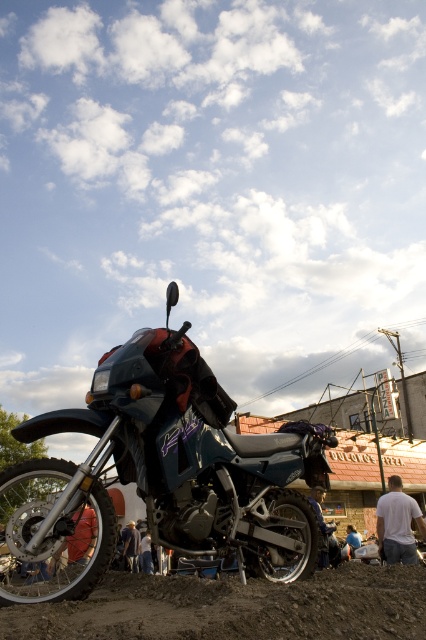
From the picture: Can you confirm if metallic blue motorcycle at center is smaller than brown dirt track at lower center?

Incorrect, metallic blue motorcycle at center is not smaller in size than brown dirt track at lower center.

Who is lower down, metallic blue motorcycle at center or brown dirt track at lower center?

metallic blue motorcycle at center

Find the location of a particular element. The width and height of the screenshot is (426, 640). metallic blue motorcycle at center is located at coordinates (161, 476).

Image resolution: width=426 pixels, height=640 pixels. What do you see at coordinates (236, 609) in the screenshot?
I see `brown dirt track at lower center` at bounding box center [236, 609].

Is brown dirt track at lower center wider than white matte shirt at lower right?

Correct, the width of brown dirt track at lower center exceeds that of white matte shirt at lower right.

Does point (198, 637) come behind point (394, 563)?

No, (198, 637) is closer to viewer.

Identify the location of brown dirt track at lower center. This screenshot has width=426, height=640. (236, 609).

Can you confirm if metallic blue motorcycle at center is taller than white matte shirt at lower right?

Yes, metallic blue motorcycle at center is taller than white matte shirt at lower right.

Measure the distance between point [112,465] and camera.

The distance of point [112,465] from camera is 4.35 meters.

Is point (232, 548) positioned in front of point (379, 500)?

Yes.

Where is `metallic blue motorcycle at center`? metallic blue motorcycle at center is located at coordinates (161, 476).